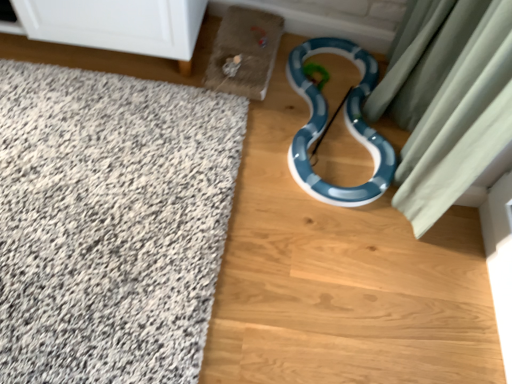
What are the coordinates of `vacant space underneath white shaggy bath mat at left (from a real-world perspective)` in the screenshot? It's located at (104, 225).